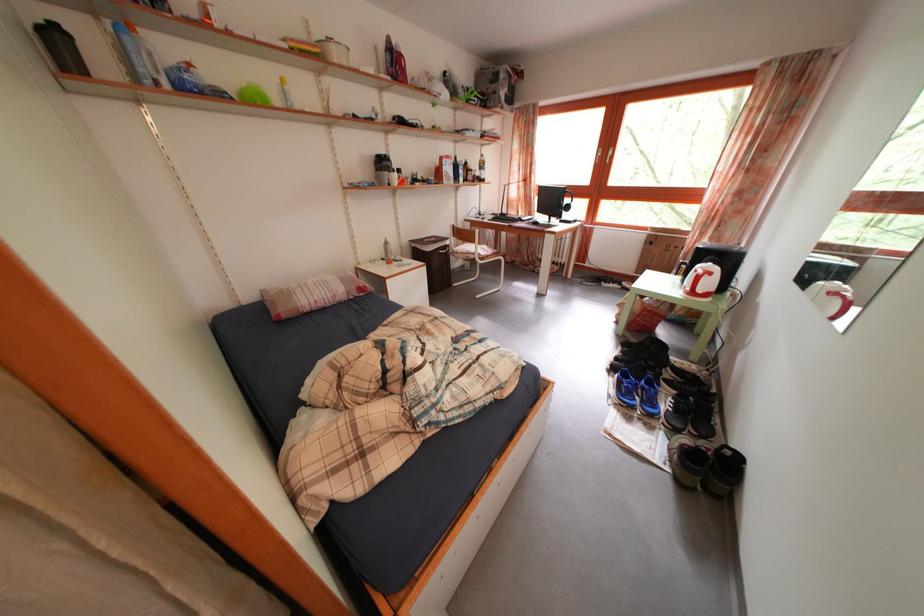
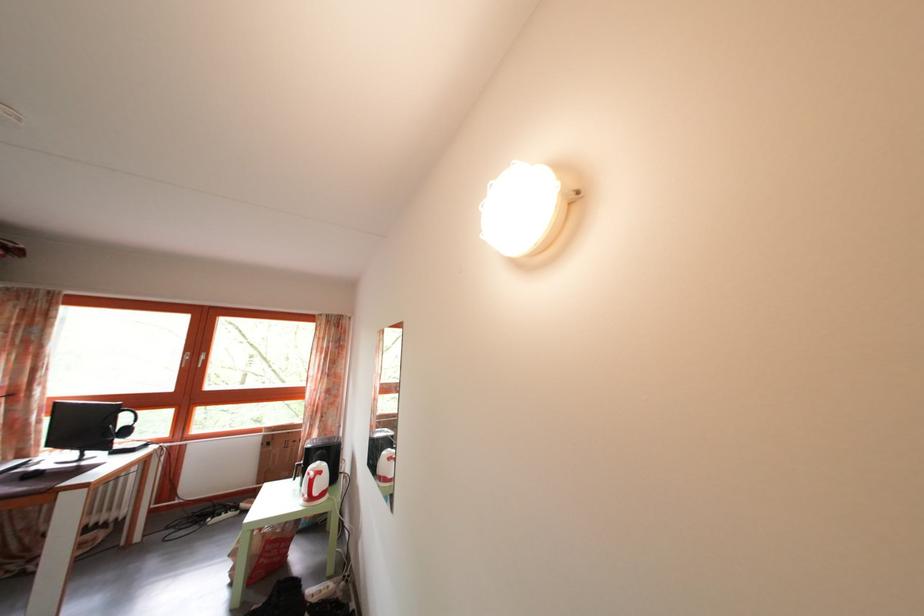
Find the pixel in the second image that matches (x=646, y=323) in the first image.

(268, 562)